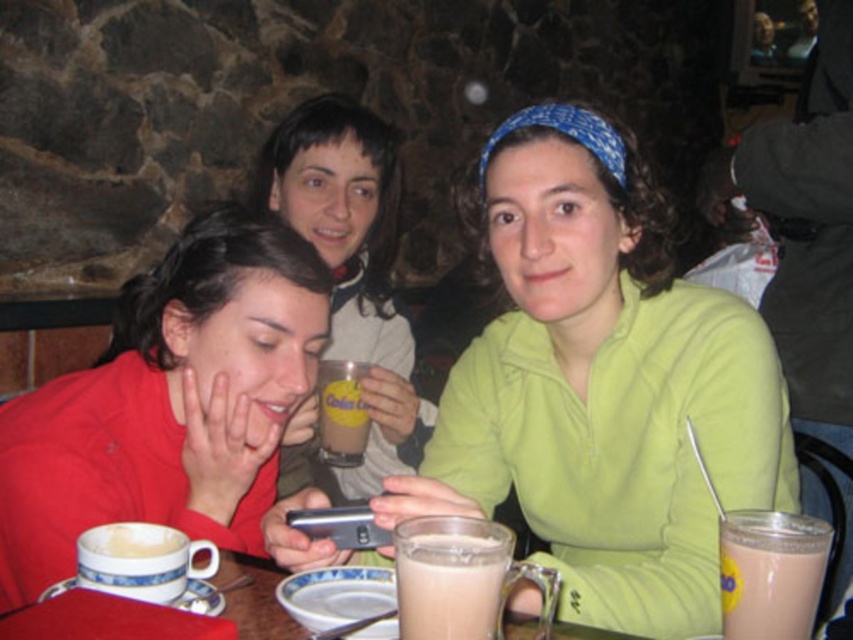
Who is positioned more to the right, matte red shirt at left or white ceramic mug at lower left?

From the viewer's perspective, white ceramic mug at lower left appears more on the right side.

Which of these two, matte red shirt at left or white ceramic mug at lower left, stands shorter?

white ceramic mug at lower left

Who is more forward, (196, 376) or (131, 576)?

Point (131, 576) is in front.

The width and height of the screenshot is (853, 640). Find the location of `matte red shirt at left`. matte red shirt at left is located at coordinates (169, 403).

Is point (705, 520) positioned behind point (76, 611)?

That is True.

Image resolution: width=853 pixels, height=640 pixels. In order to click on green matte shirt at center in this screenshot , I will do `click(602, 385)`.

Is green matte shirt at center smaller than milkshake glass at lower center?

Actually, green matte shirt at center might be larger than milkshake glass at lower center.

Find the location of a particular element. The width and height of the screenshot is (853, 640). green matte shirt at center is located at coordinates (602, 385).

Measure the distance between point (689, 544) and camera.

A distance of 98.54 centimeters exists between point (689, 544) and camera.

I want to click on green matte shirt at center, so click(602, 385).